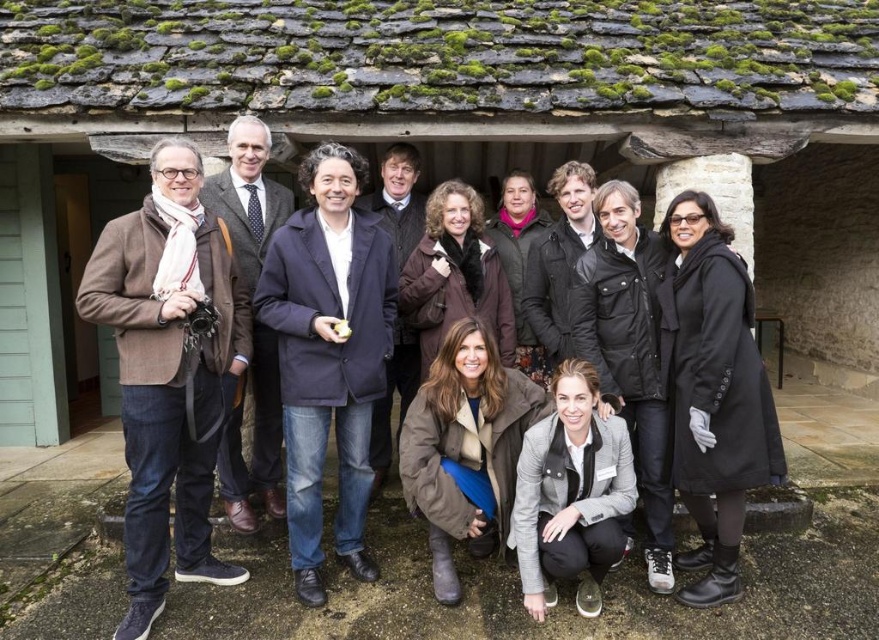
Does point (582, 612) lie in front of point (528, 349)?

Yes, point (582, 612) is closer to viewer.

Is point (527, 435) farther from viewer compared to point (522, 324)?

No, (527, 435) is in front of (522, 324).

You are a GUI agent. You are given a task and a screenshot of the screen. Output one action in this format:
    pyautogui.click(x=<x>, y=<y>)
    Task: Click on the gray matte jacket at lower center
    The image size is (879, 640).
    Given the screenshot: What is the action you would take?
    tap(570, 493)

Can you confirm if black leather coat at right is wider than brown suede boots at lower center?

No.

From the picture: Is black leather coat at right behind brown suede boots at lower center?

No, it is in front of brown suede boots at lower center.

Where is `black leather coat at right`? The width and height of the screenshot is (879, 640). black leather coat at right is located at coordinates (716, 396).

Locate an element on the screen. black leather coat at right is located at coordinates (716, 396).

In the scene shown: Who is lower down, navy blue coat at center or gray matte jacket at lower center?

gray matte jacket at lower center

Find the location of a particular element. navy blue coat at center is located at coordinates (328, 355).